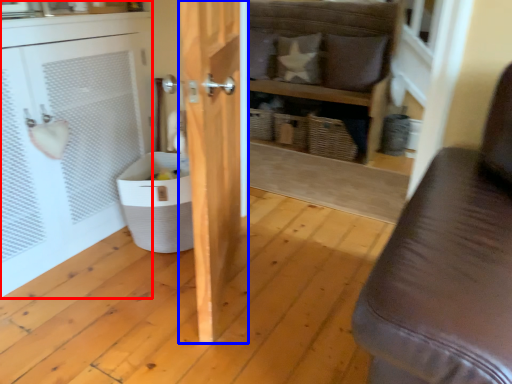
Question: Which point is closer to the camera, cabinetry (highlighted by a red box) or door (highlighted by a blue box)?

Choices:
 (A) cabinetry
 (B) door

Answer: (B)